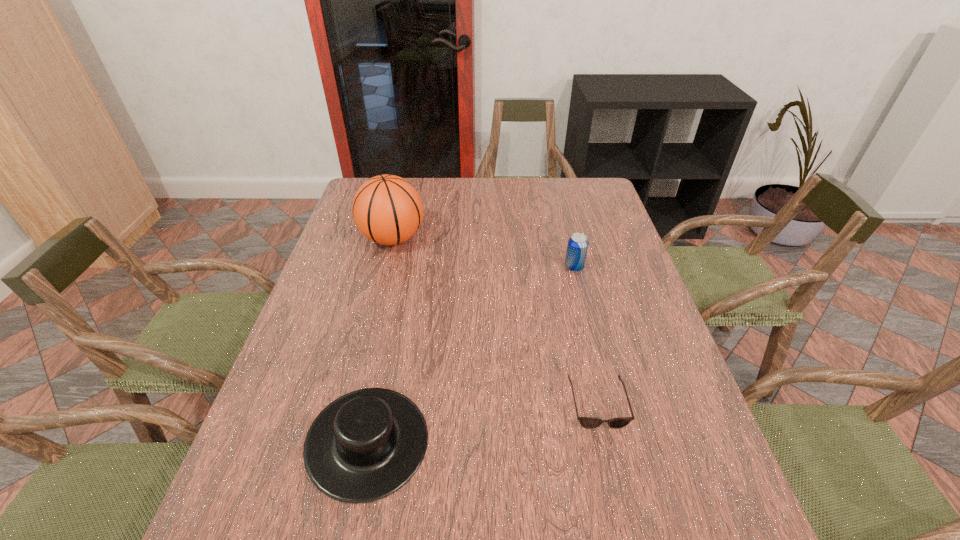
Where is `vacant region between the sunglasses and the dress hat`? This screenshot has height=540, width=960. vacant region between the sunglasses and the dress hat is located at coordinates (483, 423).

Find the location of a particular element. Image resolution: width=960 pixels, height=540 pixels. empty location between the third nearest object and the basketball is located at coordinates (483, 253).

I want to click on vacant point located between the second farthest object and the shortest object, so click(x=586, y=336).

Where is `empty space that is in between the dress hat and the tallest object`? This screenshot has width=960, height=540. empty space that is in between the dress hat and the tallest object is located at coordinates (380, 340).

I want to click on unoccupied position between the dress hat and the tallest object, so pyautogui.click(x=380, y=340).

What are the coordinates of `free area in between the beer can and the farthest object` in the screenshot? It's located at (x=483, y=253).

The height and width of the screenshot is (540, 960). In order to click on empty location between the third nearest object and the dress hat in this screenshot , I will do `click(471, 355)`.

In order to click on the third closest object to the sunglasses in this screenshot , I will do `click(387, 209)`.

Select which object appears as the third closest to the farthest object. Please provide its 2D coordinates. Your answer should be formatted as a tuple, i.e. [(x, y)], where the tuple contains the x and y coordinates of a point satisfying the conditions above.

[(587, 422)]